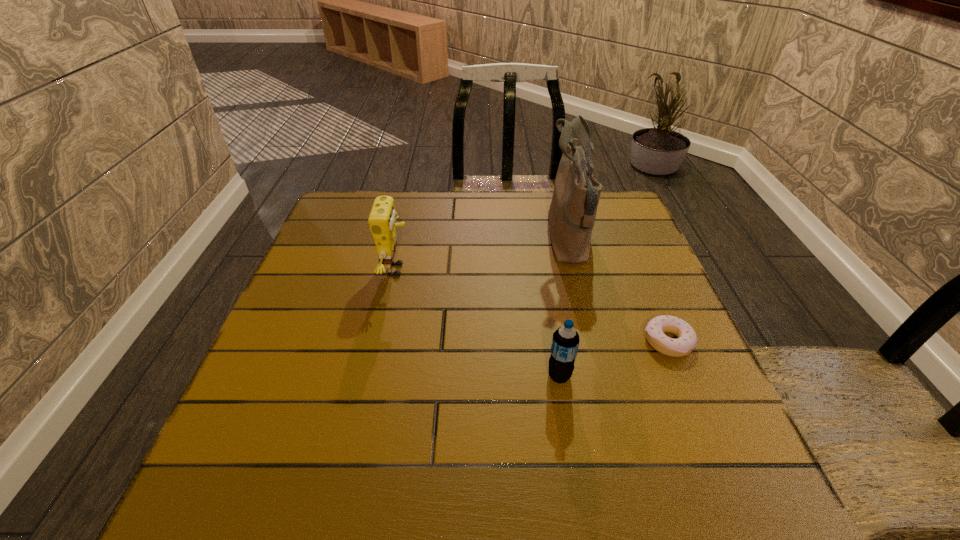
Identify the location of vacant space located 0.190m on the face of the sponge. Image resolution: width=960 pixels, height=540 pixels. (488, 270).

You are a GUI agent. You are given a task and a screenshot of the screen. Output one action in this format:
    pyautogui.click(x=<x>, y=<y>)
    Task: Click on the vacant space located 0.070m on the right of the nearest object
    The image size is (960, 540).
    Given the screenshot: What is the action you would take?
    pyautogui.click(x=608, y=376)

Where is `free space located 0.050m on the back of the shortest object`? This screenshot has width=960, height=540. free space located 0.050m on the back of the shortest object is located at coordinates (654, 308).

The image size is (960, 540). What are the coordinates of `object present at the far edge` in the screenshot? It's located at (572, 212).

The width and height of the screenshot is (960, 540). What are the coordinates of `shoulder bag that is at the right edge` in the screenshot? It's located at (572, 212).

Locate an element on the screen. doughnut that is at the right edge is located at coordinates (687, 339).

This screenshot has width=960, height=540. In order to click on object situated at the far right corner in this screenshot , I will do `click(572, 212)`.

The height and width of the screenshot is (540, 960). In the image, there is a desktop. In order to click on vacant space at the far edge in this screenshot , I will do `click(489, 235)`.

Locate an element on the screen. The image size is (960, 540). vacant space at the near edge of the desktop is located at coordinates (317, 495).

Where is `blank space at the left edge`? This screenshot has height=540, width=960. blank space at the left edge is located at coordinates (288, 335).